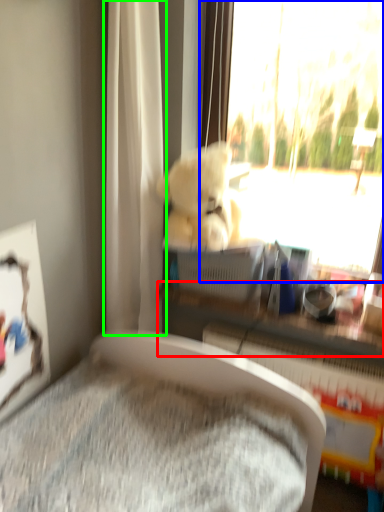
Question: Estimate the real-world distances between objects in this image. Which object is farther from shelf (highlighted by a red box), window (highlighted by a blue box) or curtain (highlighted by a green box)?

Choices:
 (A) window
 (B) curtain

Answer: (A)